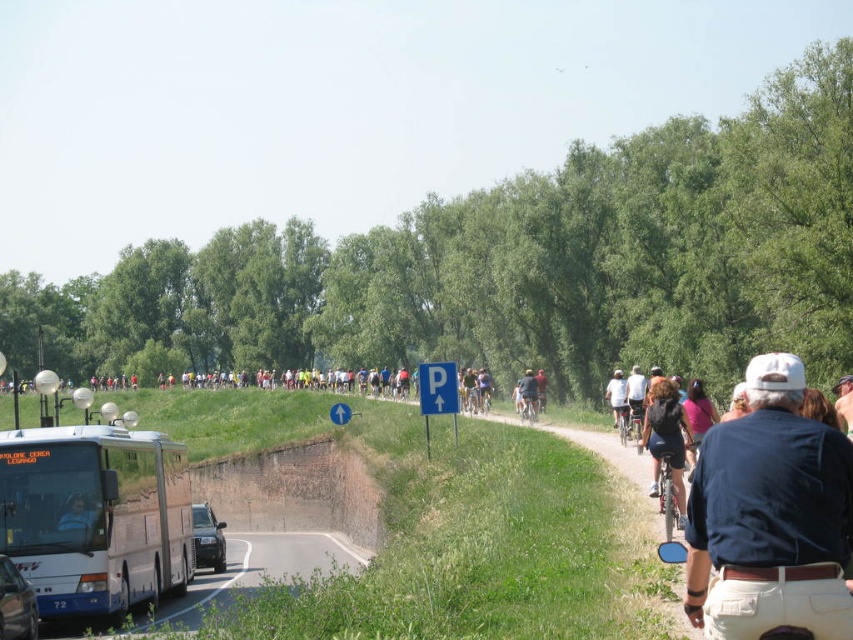
This screenshot has width=853, height=640. Describe the element at coordinates (666, 436) in the screenshot. I see `dark blue fabric backpack at right` at that location.

Is point (674, 480) farther from viewer compared to point (74, 529)?

No, it is not.

The height and width of the screenshot is (640, 853). What are the coordinates of `dark blue fabric backpack at right` in the screenshot? It's located at (666, 436).

You are a GUI agent. You are given a task and a screenshot of the screen. Output one action in this format:
    pyautogui.click(x=<x>, y=<y>)
    Task: Click on the dark blue fabric backpack at right
    This screenshot has height=640, width=853.
    Given the screenshot: What is the action you would take?
    pyautogui.click(x=666, y=436)

Can you confirm if white matte bus at lower left is shorter than shiny metallic bicycle at right?

In fact, white matte bus at lower left may be taller than shiny metallic bicycle at right.

Is white matte bus at lower left bigger than shiny metallic bicycle at right?

Yes.

Is point (173, 502) behind point (656, 468)?

Yes, point (173, 502) is behind point (656, 468).

You are a GUI agent. You are given a task and a screenshot of the screen. Output one action in this format:
    pyautogui.click(x=<x>, y=<y>)
    Task: Click on the white matte bus at lower left
    This screenshot has height=640, width=853.
    Given the screenshot: What is the action you would take?
    (x=97, y=516)

Does shiny metallic bicycle at right have a smaller size compared to white cotton shirt at center-right?

Correct, shiny metallic bicycle at right occupies less space than white cotton shirt at center-right.

Is shiny metallic bicycle at right thinner than white cotton shirt at center-right?

Yes.

Where is `shiny metallic bicycle at right`? This screenshot has width=853, height=640. shiny metallic bicycle at right is located at coordinates (666, 490).